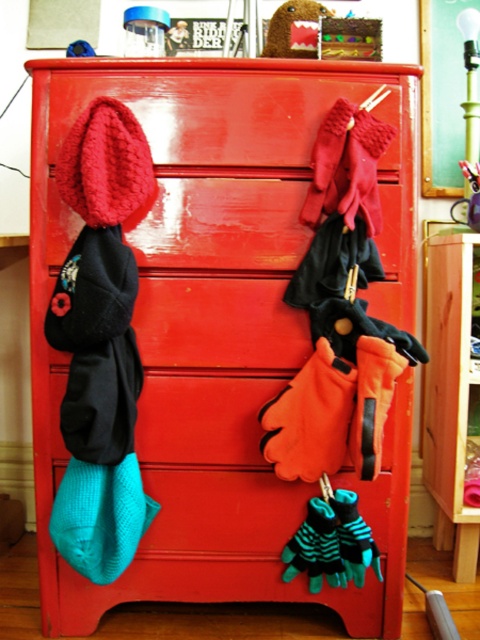
You are trying to decide whether to place a small decorative item on the fuzzy brown bear at upper center or the teal knitted sock at lower left. Which surface has more space available for placement?

The teal knitted sock at lower left might have more space available because it might be wider than the fuzzy brown bear at upper center.

Looking at this image, you are organizing a drawer and need to place the teal knitted sock at lower left and the fuzzy brown bear at upper center. Based on their positions in the image, which object is closer to the bottom of the chest of drawers?

The teal knitted sock at lower left is located below the fuzzy brown bear at upper center, so it is closer to the bottom of the chest of drawers.

You are organizing a toy store and need to place the fuzzy brown bear at upper center and the metallic silver scissors at upper right on a shelf. Based on their positions in the image, which toy should be placed to the left of the other?

The fuzzy brown bear at upper center should be placed to the left of the metallic silver scissors at upper right because it is positioned on the left side of the scissors in the image.